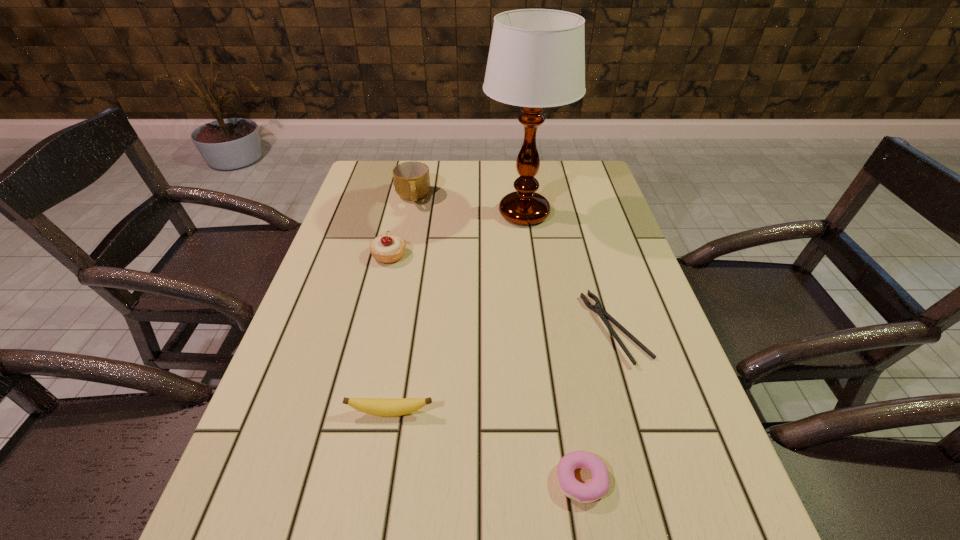
Identify the location of vacant space situated on the front of the tallest object. (533, 279).

You are a GUI agent. You are given a task and a screenshot of the screen. Output one action in this format:
    pyautogui.click(x=<x>, y=<y>)
    Task: Click on the vacant space located 0.340m on the side with the handle of the fifth shortest object
    This screenshot has height=540, width=960.
    Given the screenshot: What is the action you would take?
    pyautogui.click(x=394, y=287)

The width and height of the screenshot is (960, 540). Find the location of `free space located 0.160m on the right of the left pastry`. free space located 0.160m on the right of the left pastry is located at coordinates (467, 255).

The height and width of the screenshot is (540, 960). I want to click on vacant space located 0.120m on the front of the banana, so click(x=378, y=484).

The width and height of the screenshot is (960, 540). I want to click on vacant space situated on the left of the nearer pastry, so click(509, 481).

The height and width of the screenshot is (540, 960). In order to click on blank space located 0.090m on the front of the fourth farthest object in this screenshot , I will do `click(639, 407)`.

At what (x,y) coordinates should I click in order to perform the action: click on table lamp at the far edge. Please return your answer as a coordinate pair (x, y). Image resolution: width=960 pixels, height=540 pixels. Looking at the image, I should click on (536, 59).

Where is `mug present at the far edge`? Image resolution: width=960 pixels, height=540 pixels. mug present at the far edge is located at coordinates 411,179.

Where is `mug that is at the left edge`? mug that is at the left edge is located at coordinates (411, 179).

Find the location of a particular element. The height and width of the screenshot is (540, 960). pastry at the left edge is located at coordinates (386, 248).